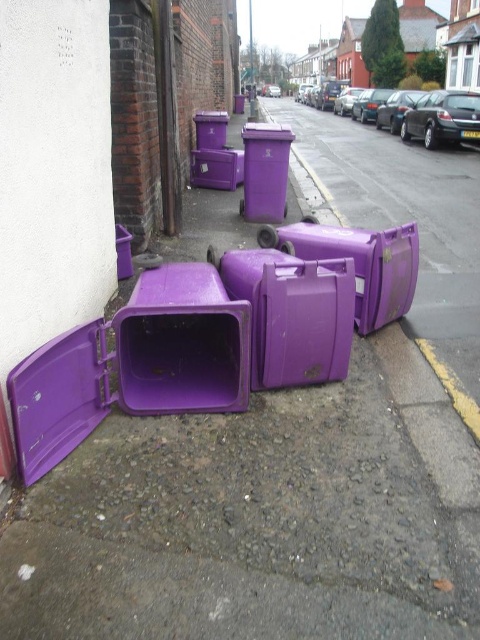
Consider the image. Is purple plastic bin at center wider than matte plastic trash can at center?

Indeed, purple plastic bin at center has a greater width compared to matte plastic trash can at center.

Who is higher up, purple plastic bin at center or matte plastic trash can at center?

matte plastic trash can at center

Is point (412, 262) closer to camera compared to point (267, 170)?

Yes.

Locate an element on the screen. purple plastic bin at center is located at coordinates (359, 262).